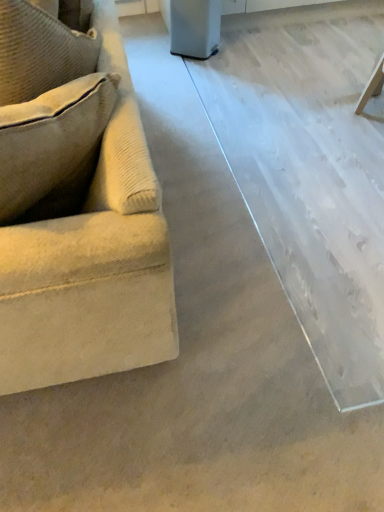
The image size is (384, 512). What do you see at coordinates (84, 234) in the screenshot? I see `beige corduroy couch at left` at bounding box center [84, 234].

Identify the location of beige corduroy couch at left. (84, 234).

The width and height of the screenshot is (384, 512). Find the location of `beige corduroy couch at left`. beige corduroy couch at left is located at coordinates (84, 234).